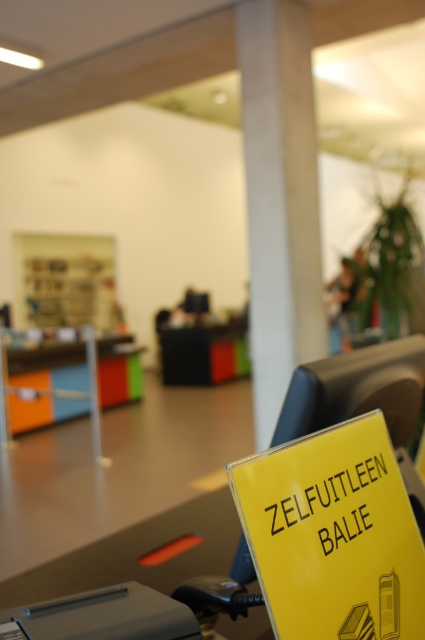
Question: Which point is closer to the camera?

Choices:
 (A) (232, 330)
 (B) (85, 257)
 (C) (175, 616)
 (D) (260, 292)

Answer: (C)

Question: Is yellow paper sign at lower right below concrete pillar at center?

Choices:
 (A) yes
 (B) no

Answer: (A)

Question: Which point is farther to the camera?

Choices:
 (A) yellow paper sign at lower right
 (B) wooden bookshelf at center
 (C) black plastic desk at center

Answer: (C)

Question: Among these objects, which one is farthest from the camera?

Choices:
 (A) gray plastic printer at lower left
 (B) yellow paper sign at lower right
 (C) orange plastic desk at center
 (D) wooden bookshelf at center

Answer: (D)

Question: Does orange plastic desk at center appear over black plastic desk at center?

Choices:
 (A) no
 (B) yes

Answer: (A)

Question: Considering the relative positions of orange plastic desk at center and black plastic desk at center in the image provided, where is orange plastic desk at center located with respect to black plastic desk at center?

Choices:
 (A) right
 (B) left

Answer: (B)